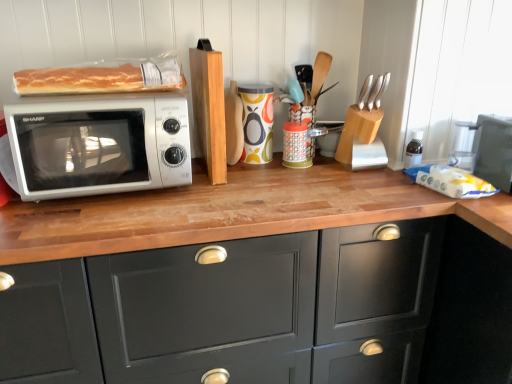
Where is `silver metallic knife block at upper right`? This screenshot has height=384, width=512. silver metallic knife block at upper right is located at coordinates click(x=373, y=91).

Find the location of a particular element. matte black toaster oven at right, marked as the 4th appliance in a left-to-right arrangement is located at coordinates (493, 151).

Measure the distance between translucent plastic bread at upper left and camera.

1.10 meters.

You are a GUI agent. You are given a task and a screenshot of the screen. Output one action in this format:
    pyautogui.click(x=<x>, y=<y>)
    Task: Click on the wooden knife block at center, arranged as the third appliance when viewed from the right
    The image size is (512, 384).
    Given the screenshot: What is the action you would take?
    pyautogui.click(x=329, y=137)

Measure the distance between point (222,173) and camera.

The depth of point (222,173) is 1.34 meters.

Locate an element on the screen. Image resolution: width=512 pixels, height=384 pixels. colorful ceramic mug at center, which ranks as the 4th appliance in right-to-left order is located at coordinates (257, 122).

Is the surface of colorful ceramic mug at center, which ranks as the 4th appliance in right-to-left order, in direct contact with translucent plastic bread at upper left?

They are not placed beside each other.

From the image's perspective, would you say colorful ceramic mug at center, the first appliance from the left, is positioned over translucent plastic bread at upper left?

No.

Does colorful ceramic mug at center, the first appliance from the left, have a greater width compared to translucent plastic bread at upper left?

In fact, colorful ceramic mug at center, the first appliance from the left, might be narrower than translucent plastic bread at upper left.

Is wooden knife block at center, arranged as the third appliance when viewed from the right, in front of or behind silver metallic knife block at upper right in the image?

wooden knife block at center, arranged as the third appliance when viewed from the right, is behind silver metallic knife block at upper right.

Is wooden knife block at center, arranged as the third appliance when viewed from the right, positioned with its back to silver metallic knife block at upper right?

No, wooden knife block at center, arranged as the third appliance when viewed from the right, is not facing away from silver metallic knife block at upper right.

Considering the sizes of wooden knife block at center, arranged as the third appliance when viewed from the right, and silver metallic knife block at upper right in the image, is wooden knife block at center, arranged as the third appliance when viewed from the right, bigger or smaller than silver metallic knife block at upper right?

Considering their sizes, wooden knife block at center, arranged as the third appliance when viewed from the right, takes up more space than silver metallic knife block at upper right.

From the image's perspective, is matte black toaster oven at right, acting as the 1th appliance starting from the right, under satin silver microwave at left?

Indeed, from the image's perspective, matte black toaster oven at right, acting as the 1th appliance starting from the right, is shown beneath satin silver microwave at left.

Who is more distant, matte black toaster oven at right, acting as the 1th appliance starting from the right, or satin silver microwave at left?

Positioned behind is matte black toaster oven at right, acting as the 1th appliance starting from the right.

Are matte black toaster oven at right, marked as the 4th appliance in a left-to-right arrangement, and satin silver microwave at left located far from each other?

Absolutely, matte black toaster oven at right, marked as the 4th appliance in a left-to-right arrangement, is distant from satin silver microwave at left.

Does point (475, 160) come behind point (92, 141)?

That is True.

Considering the sizes of objects silver metallic knife block at upper right and colorful ceramic mug at center, which ranks as the 4th appliance in right-to-left order, in the image provided, who is bigger, silver metallic knife block at upper right or colorful ceramic mug at center, which ranks as the 4th appliance in right-to-left order,?

With larger size is colorful ceramic mug at center, which ranks as the 4th appliance in right-to-left order.

Is point (373, 89) positioned in front of point (272, 99)?

Yes, point (373, 89) is in front of point (272, 99).

From the image's perspective, which is below, silver metallic knife block at upper right or colorful ceramic mug at center, which ranks as the 4th appliance in right-to-left order?

colorful ceramic mug at center, which ranks as the 4th appliance in right-to-left order, from the image's perspective.

From the picture: From a real-world perspective, is silver metallic knife block at upper right beneath colorful ceramic mug at center, which ranks as the 4th appliance in right-to-left order?

No, from a real-world perspective, silver metallic knife block at upper right is not beneath colorful ceramic mug at center, which ranks as the 4th appliance in right-to-left order.

Which object is wider, light brown wooden block at center or wooden knife block at center, arranged as the third appliance when viewed from the right?

light brown wooden block at center is wider.

Choose the correct answer: Is light brown wooden block at center inside wooden knife block at center, arranged as the third appliance when viewed from the right, or outside it?

light brown wooden block at center is located beyond the bounds of wooden knife block at center, arranged as the third appliance when viewed from the right.

From a real-world perspective, is light brown wooden block at center positioned above or below wooden knife block at center, which is counted as the 2th appliance, starting from the left?

light brown wooden block at center is situated higher than wooden knife block at center, which is counted as the 2th appliance, starting from the left, in the real world.

Is light brown wooden block at center placed right next to wooden knife block at center, which is counted as the 2th appliance, starting from the left?

light brown wooden block at center is not next to wooden knife block at center, which is counted as the 2th appliance, starting from the left, and they're not touching.

From a real-world perspective, is colorful ceramic mug at center, the first appliance from the left, on silver metallic knife block at upper right?

No, from a real-world perspective, colorful ceramic mug at center, the first appliance from the left, is not over silver metallic knife block at upper right

Where is `silverware to the right of colorful ceramic mug at center, which ranks as the 4th appliance in right-to-left order`? Image resolution: width=512 pixels, height=384 pixels. silverware to the right of colorful ceramic mug at center, which ranks as the 4th appliance in right-to-left order is located at coordinates (373, 91).

Is colorful ceramic mug at center, the first appliance from the left, oriented towards silver metallic knife block at upper right?

No, colorful ceramic mug at center, the first appliance from the left, is not turned towards silver metallic knife block at upper right.

Is point (244, 136) farther from viewer compared to point (384, 89)?

Yes, it is.

Is matte black toaster oven at right, marked as the 4th appliance in a left-to-right arrangement, not close to matte black cabinet at center?

No, matte black toaster oven at right, marked as the 4th appliance in a left-to-right arrangement, is not far away from matte black cabinet at center.

I want to click on cabinetry that is on the left side of matte black toaster oven at right, acting as the 1th appliance starting from the right, so click(146, 312).

Is matte black toaster oven at right, marked as the 4th appliance in a left-to-right arrangement, positioned beyond the bounds of matte black cabinet at center?

Indeed, matte black toaster oven at right, marked as the 4th appliance in a left-to-right arrangement, is completely outside matte black cabinet at center.

Find the location of a particular element. food on the left of colorful ceramic mug at center, the first appliance from the left is located at coordinates (100, 78).

Find the location of a particular element. The height and width of the screenshot is (384, 512). silverware above the wooden knife block at center, arranged as the third appliance when viewed from the right (from a real-world perspective) is located at coordinates (373, 91).

In the scene shown: Looking at the image, which one is located closer to light brown wooden block at center, matte black toaster oven at right, marked as the 4th appliance in a left-to-right arrangement, or matte black cabinet at center?

matte black cabinet at center.

Based on their spatial positions, is light brown wooden block at center or translucent plastic bread at upper left closer to colorful ceramic mug at center, which ranks as the 4th appliance in right-to-left order?

light brown wooden block at center is closer to colorful ceramic mug at center, which ranks as the 4th appliance in right-to-left order.

When comparing their distances from colorful ceramic mug at center, the first appliance from the left, does light brown wooden block at center or matte black cabinet at center seem further?

matte black cabinet at center.

Which object lies nearer to the anchor point satin silver microwave at left, matte black cabinet at center or wooden knife block at center, which is counted as the 2th appliance, starting from the left?

matte black cabinet at center.

Estimate the real-world distances between objects in this image. Which object is further from matte black toaster oven at right, acting as the 1th appliance starting from the right, wooden knife block at upper right, the second appliance viewed from the right, or light brown wooden block at center?

light brown wooden block at center lies further to matte black toaster oven at right, acting as the 1th appliance starting from the right, than the other object.

Looking at the image, which one is located closer to matte black toaster oven at right, marked as the 4th appliance in a left-to-right arrangement, translucent plastic bread at upper left or light brown wooden block at center?

light brown wooden block at center.

Estimate the real-world distances between objects in this image. Which object is closer to light brown wooden block at center, wooden knife block at center, arranged as the third appliance when viewed from the right, or wooden knife block at upper right, the second appliance viewed from the right?

wooden knife block at upper right, the second appliance viewed from the right, is positioned closer to the anchor light brown wooden block at center.

Considering their positions, is colorful ceramic mug at center, which ranks as the 4th appliance in right-to-left order, positioned closer to translucent plastic bread at upper left than wooden knife block at center, arranged as the third appliance when viewed from the right?

colorful ceramic mug at center, which ranks as the 4th appliance in right-to-left order, is closer to translucent plastic bread at upper left.

This screenshot has height=384, width=512. I want to click on wood located between satin silver microwave at left and wooden knife block at center, arranged as the third appliance when viewed from the right, in the left-right direction, so click(209, 108).

Where is `wood situated between satin silver microwave at left and colorful ceramic mug at center, the first appliance from the left, from left to right`? wood situated between satin silver microwave at left and colorful ceramic mug at center, the first appliance from the left, from left to right is located at coordinates (209, 108).

Find the location of a particular element. wood between translucent plastic bread at upper left and wooden knife block at upper right, placed as the third appliance when sorted from left to right, in the horizontal direction is located at coordinates (209, 108).

You are a GUI agent. You are given a task and a screenshot of the screen. Output one action in this format:
    pyautogui.click(x=<x>, y=<y>)
    Task: Click on the food located between satin silver microwave at left and wooden knife block at center, arranged as the third appliance when viewed from the right, in the left-right direction
    
    Given the screenshot: What is the action you would take?
    pyautogui.click(x=100, y=78)